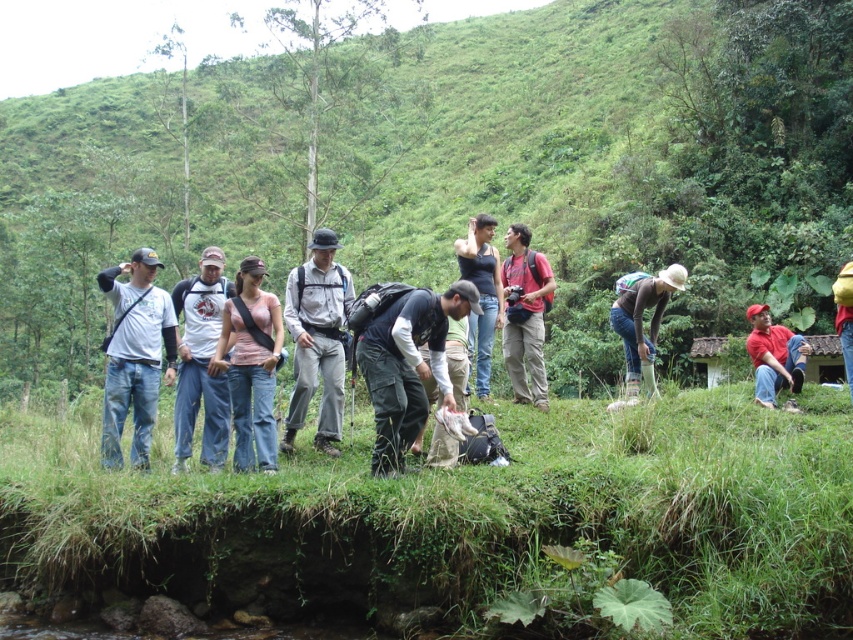
Question: Which object is the closest to the light brown fabric shirt at center?

Choices:
 (A) dark gray fabric backpack at center
 (B) white cotton shirt at center
 (C) red matte shirt at lower right

Answer: (B)

Question: Is light brown fabric shirt at center closer to camera compared to white cotton shirt at center?

Choices:
 (A) yes
 (B) no

Answer: (B)

Question: Can you confirm if denim jeans at left is positioned above white cotton shirt at center?

Choices:
 (A) yes
 (B) no

Answer: (A)

Question: Is denim jeans at center positioned before red matte shirt at lower right?

Choices:
 (A) no
 (B) yes

Answer: (A)

Question: Estimate the real-world distances between objects in this image. Which object is closer to the matte red shirt at center?

Choices:
 (A) white cotton shirt at center
 (B) yellow fabric bag at center-right
 (C) red matte shirt at lower right
 (D) matte black tank top at center

Answer: (D)

Question: Which object is farther from the camera taking this photo?

Choices:
 (A) matte black tank top at center
 (B) red matte shirt at lower right
 (C) denim jeans at center
 (D) light brown fabric shirt at center

Answer: (C)